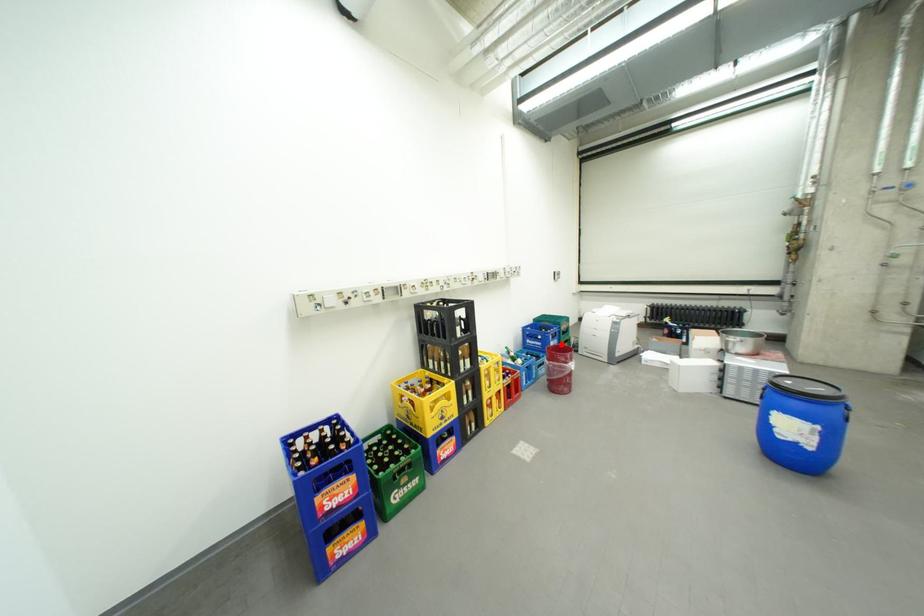
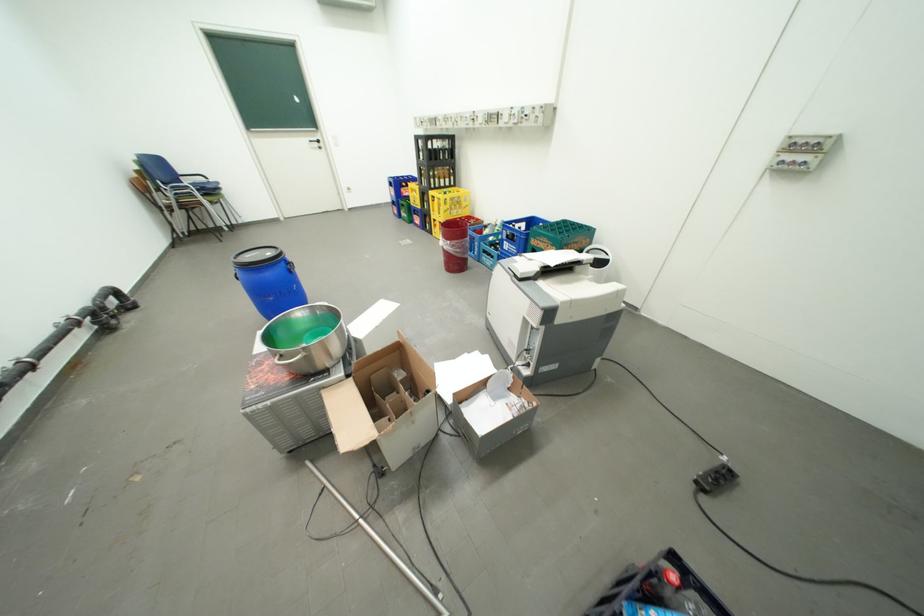
In the second image, find the point that corresponds to the highlighted location in the first image.

(516, 244)